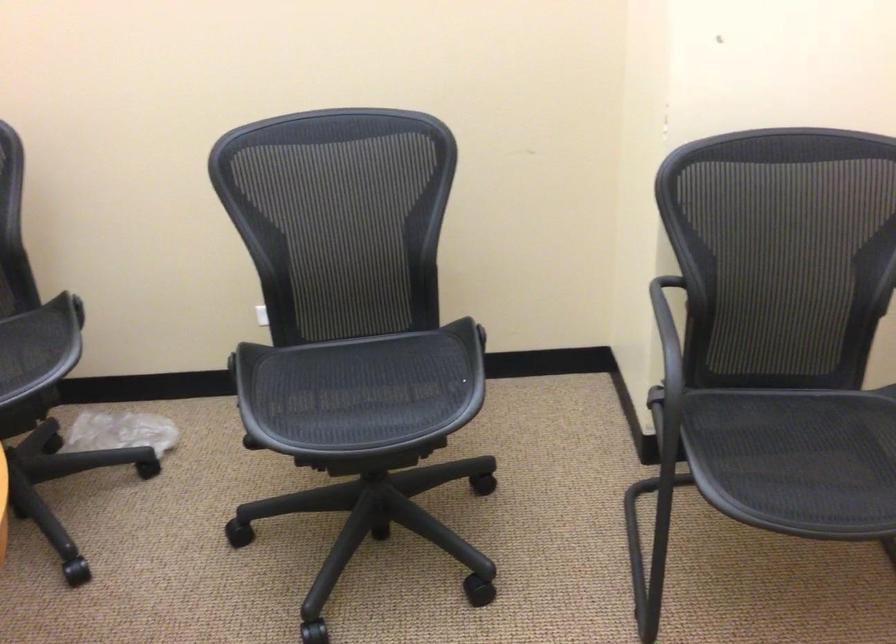
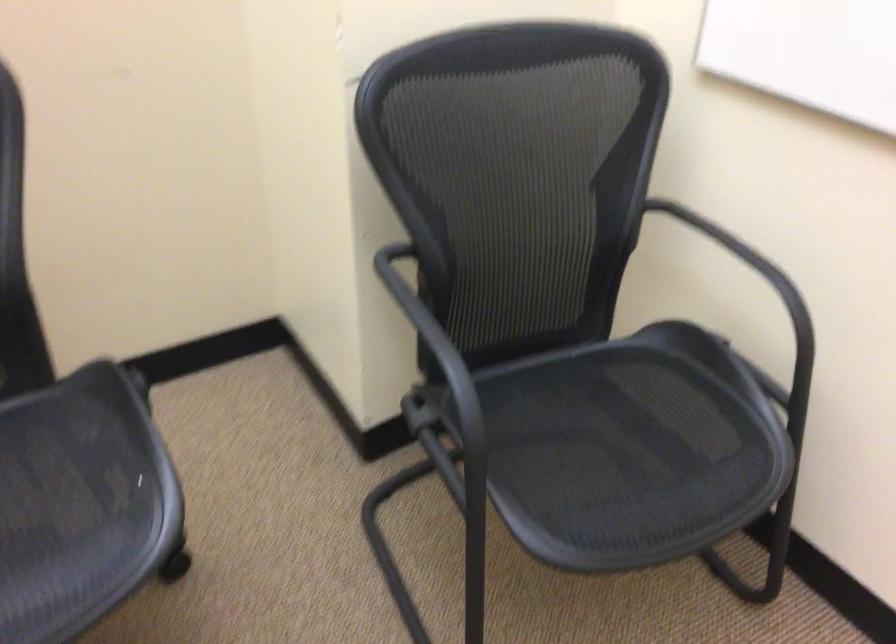
The point at (664, 345) is marked in the first image. Where is the corresponding point in the second image?

(438, 357)